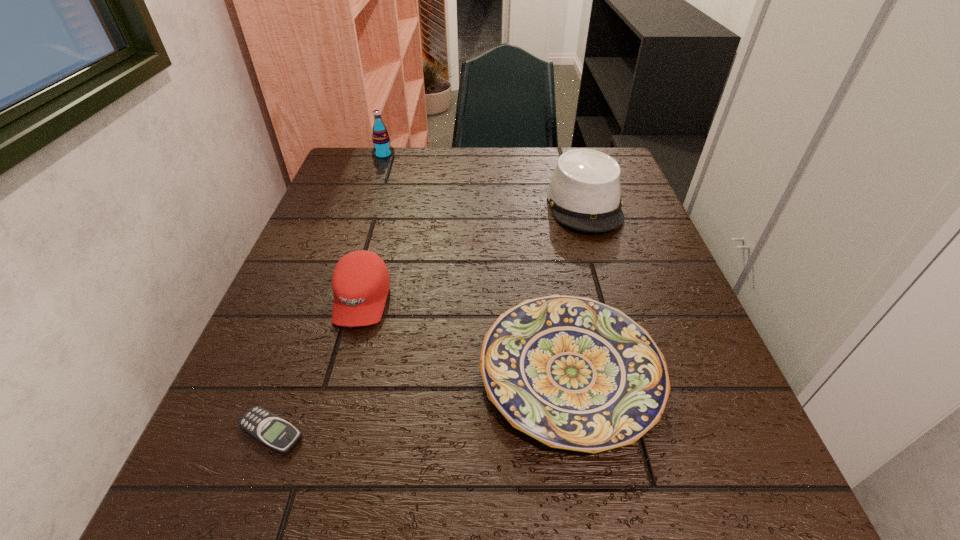
Locate an element on the screen. This screenshot has width=960, height=540. vacant space at the far edge of the desktop is located at coordinates (526, 189).

At what (x,y) coordinates should I click in order to perform the action: click on vacant space at the near edge of the desktop. Please return your answer as a coordinate pair (x, y). Looking at the image, I should click on (509, 512).

Image resolution: width=960 pixels, height=540 pixels. I want to click on free space at the left edge, so click(269, 342).

This screenshot has width=960, height=540. In the image, there is a desktop. Identify the location of vacant space at the right edge. (682, 289).

The height and width of the screenshot is (540, 960). Identify the location of vacant area at the far left corner. (368, 170).

I want to click on vacant area that lies between the farthest object and the second tallest object, so click(484, 180).

The height and width of the screenshot is (540, 960). I want to click on free spot between the second shortest object and the tallest object, so click(477, 264).

Find the location of a particular element. This screenshot has height=540, width=960. free spot between the plate and the cap is located at coordinates (466, 336).

Locate an element on the screen. Image resolution: width=960 pixels, height=540 pixels. vacant area that lies between the shortest object and the second shortest object is located at coordinates (420, 403).

Locate an element on the screen. Image resolution: width=960 pixels, height=540 pixels. empty space that is in between the cap and the soda is located at coordinates (372, 228).